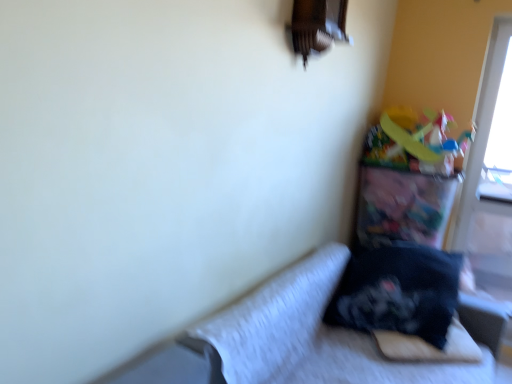
Question: Is the position of black soft pillow at lower right more distant than that of transparent plastic screen door at right?

Choices:
 (A) yes
 (B) no

Answer: (B)

Question: Is black soft pillow at lower right at the left side of transparent plastic screen door at right?

Choices:
 (A) no
 (B) yes

Answer: (B)

Question: From the image's perspective, is black soft pillow at lower right under transparent plastic screen door at right?

Choices:
 (A) yes
 (B) no

Answer: (A)

Question: Can you confirm if black soft pillow at lower right is shorter than transparent plastic screen door at right?

Choices:
 (A) no
 (B) yes

Answer: (B)

Question: Does black soft pillow at lower right appear on the right side of transparent plastic screen door at right?

Choices:
 (A) yes
 (B) no

Answer: (B)

Question: Considering the positions of point (444, 370) and point (495, 36), is point (444, 370) closer or farther from the camera than point (495, 36)?

Choices:
 (A) farther
 (B) closer

Answer: (B)

Question: Based on their positions, is velvet black pillow at lower right located to the left or right of transparent plastic screen door at right?

Choices:
 (A) right
 (B) left

Answer: (B)

Question: Is velvet black pillow at lower right in front of or behind transparent plastic screen door at right in the image?

Choices:
 (A) behind
 (B) front

Answer: (B)

Question: From their relative heights in the image, would you say velvet black pillow at lower right is taller or shorter than transparent plastic screen door at right?

Choices:
 (A) tall
 (B) short

Answer: (B)

Question: Is point (487, 261) positioned closer to the camera than point (436, 304)?

Choices:
 (A) farther
 (B) closer

Answer: (A)

Question: From a real-world perspective, relative to black soft pillow at lower right, is transparent plastic screen door at right vertically above or below?

Choices:
 (A) below
 (B) above

Answer: (B)

Question: Is transparent plastic screen door at right bigger or smaller than black soft pillow at lower right?

Choices:
 (A) small
 (B) big

Answer: (B)

Question: Considering the positions of transparent plastic screen door at right and black soft pillow at lower right in the image, is transparent plastic screen door at right wider or thinner than black soft pillow at lower right?

Choices:
 (A) wide
 (B) thin

Answer: (B)

Question: Would you say black soft pillow at lower right is to the left or to the right of velvet black pillow at lower right in the picture?

Choices:
 (A) left
 (B) right

Answer: (B)

Question: Is point (393, 281) closer or farther from the camera than point (381, 357)?

Choices:
 (A) closer
 (B) farther

Answer: (B)